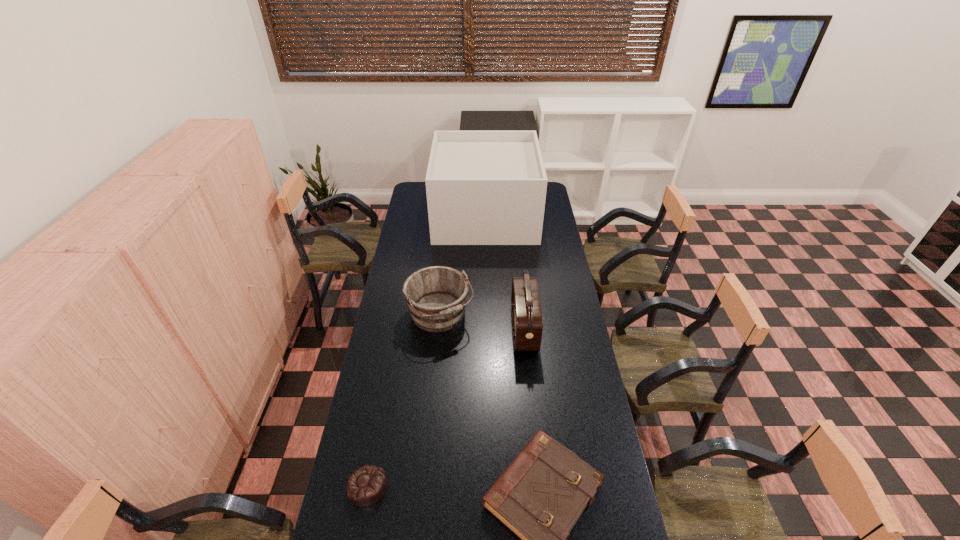
Where is `the farthest object`? The image size is (960, 540). the farthest object is located at coordinates 483,187.

Find the location of a particular element. the tallest object is located at coordinates (483, 187).

Locate an element on the screen. The height and width of the screenshot is (540, 960). the fourth shortest object is located at coordinates (527, 321).

Locate an element on the screen. The image size is (960, 540). the third shortest object is located at coordinates (436, 296).

This screenshot has width=960, height=540. In order to click on beanbag in this screenshot , I will do `click(366, 486)`.

The height and width of the screenshot is (540, 960). Identify the location of free space located 0.110m on the side of the tallest object with the window. (417, 215).

The width and height of the screenshot is (960, 540). I want to click on vacant space located 0.060m on the side of the tallest object with the window, so click(425, 215).

This screenshot has height=540, width=960. Find the location of `vacant area situated 0.270m on the front panel of the radio receiver`. vacant area situated 0.270m on the front panel of the radio receiver is located at coordinates (450, 329).

At what (x,y) coordinates should I click in order to perform the action: click on vacant space located 0.250m on the front panel of the radio receiver. Please return your answer as a coordinate pair (x, y). The width and height of the screenshot is (960, 540). Looking at the image, I should click on (454, 329).

At what (x,y) coordinates should I click in order to perform the action: click on free region located 0.160m on the front panel of the radio receiver. Please return your answer as a coordinate pair (x, y). Looking at the image, I should click on click(x=475, y=329).